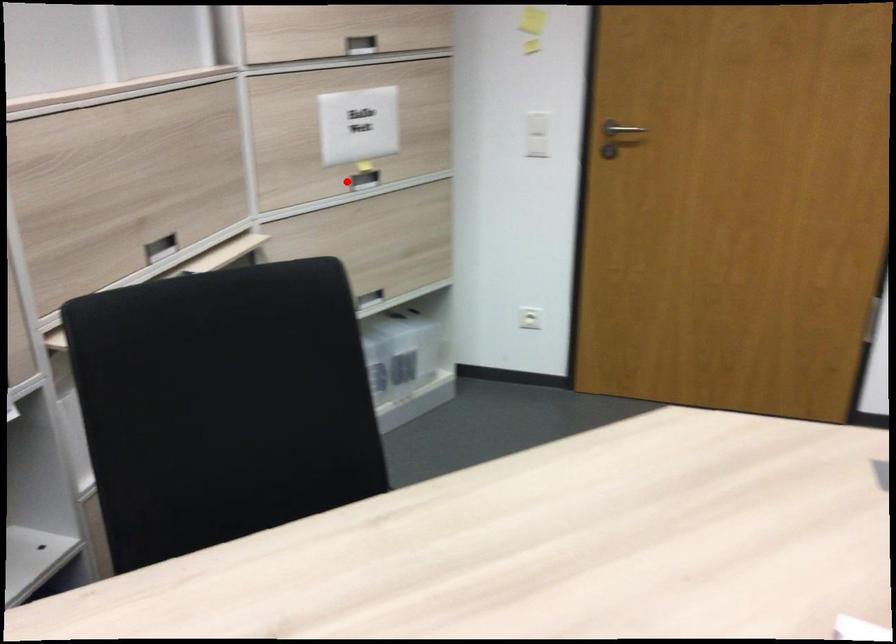
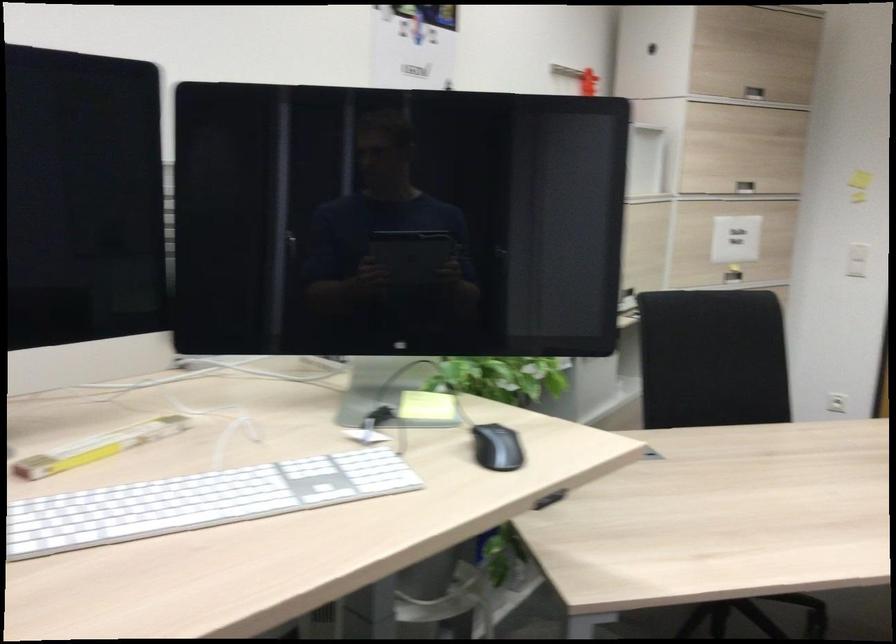
Where in the second image is the point corresponding to the highlighted location from the first image?

(733, 275)